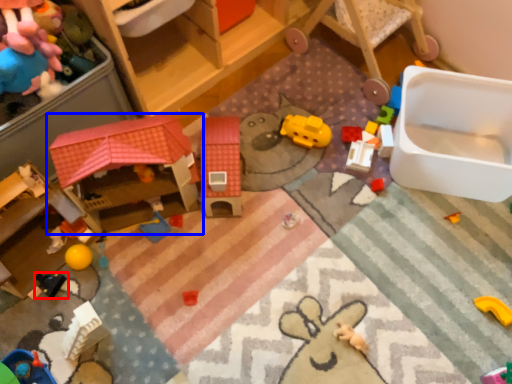
Question: Which of the following is the farthest to the observer, toy (highlighted by a red box) or toy (highlighted by a blue box)?

Choices:
 (A) toy
 (B) toy

Answer: (A)